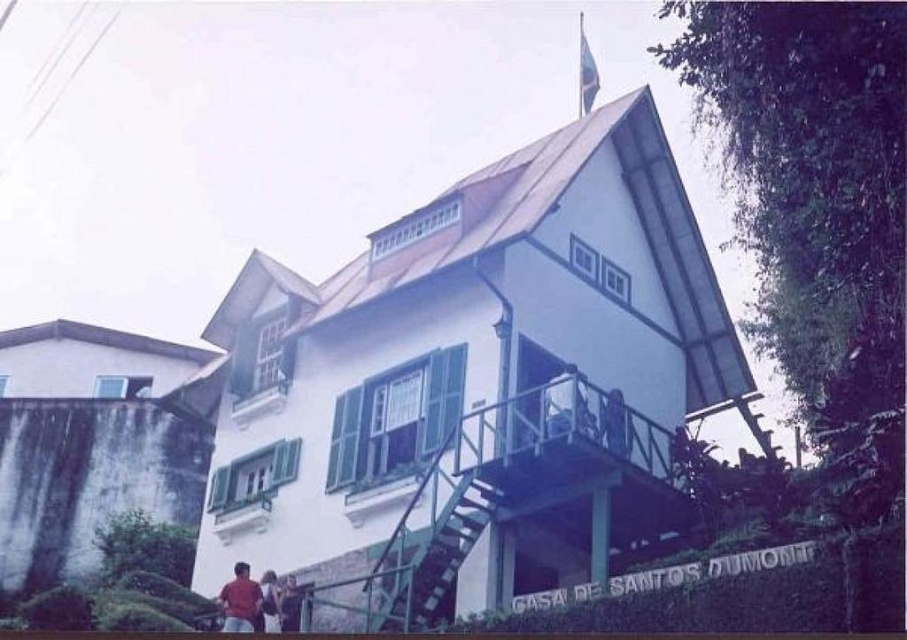
You are a painter standing on the ground level near the white painted wood balcony at lower left and the matte red shirt at lower left. You want to paint both objects but need to know which one requires more horizontal space. Which object is wider?

The white painted wood balcony at lower left might be wider than matte red shirt at lower left according to the description.

You are standing in front of the house and notice the white painted wood balcony at lower left and the matte red shirt at lower center. Which object is closer to you?

The white painted wood balcony at lower left is closer to you since the matte red shirt at lower center is behind it.

You are a painter who needs to decide which item to paint first between the white painted wood balcony at lower left and the matte red shirt at lower left. Considering their sizes, which one should you start with and why?

The white painted wood balcony at lower left is bigger than the matte red shirt at lower left, so you should start with the white painted wood balcony at lower left because it requires more time and effort due to its larger size.